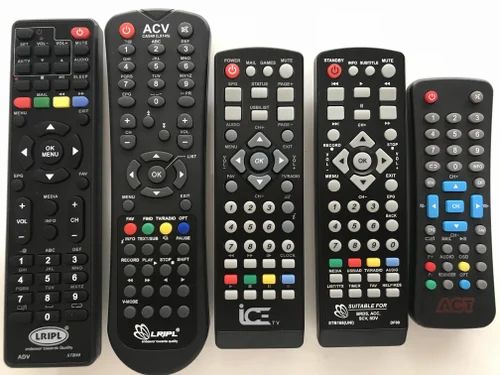
This screenshot has width=500, height=375. In order to click on remotes in this screenshot , I will do `click(73, 177)`, `click(163, 184)`, `click(258, 192)`, `click(333, 192)`, `click(451, 212)`.